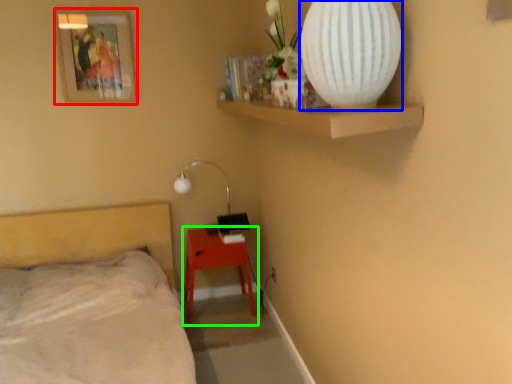
Question: Which object is positioned closest to picture frame (highlighted by a red box)? Select from vase (highlighted by a blue box) and nightstand (highlighted by a green box).

Choices:
 (A) vase
 (B) nightstand

Answer: (B)